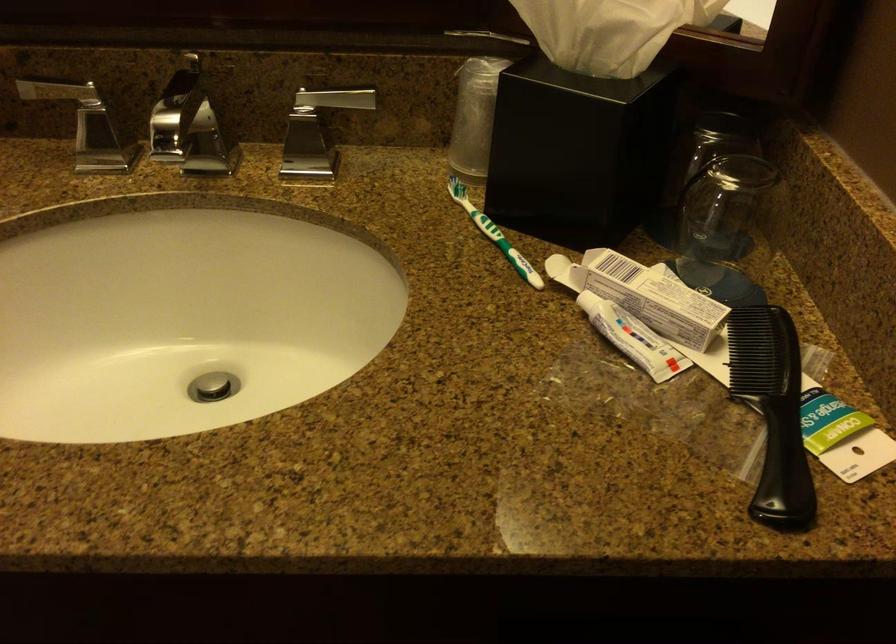
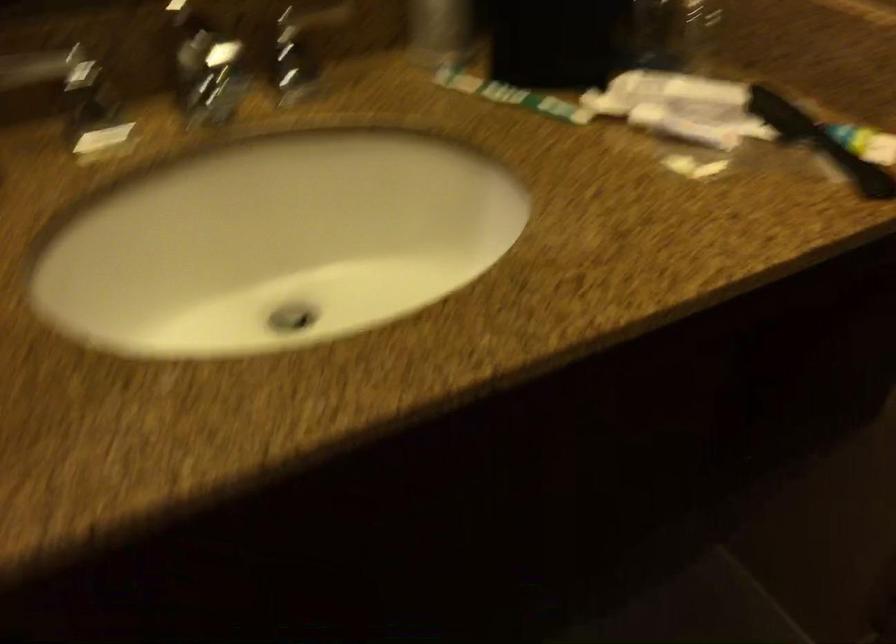
Question: The images are taken continuously from a first-person perspective. In which direction is your viewpoint rotating?

Choices:
 (A) Left
 (B) Right
 (C) Up
 (D) Down

Answer: (B)